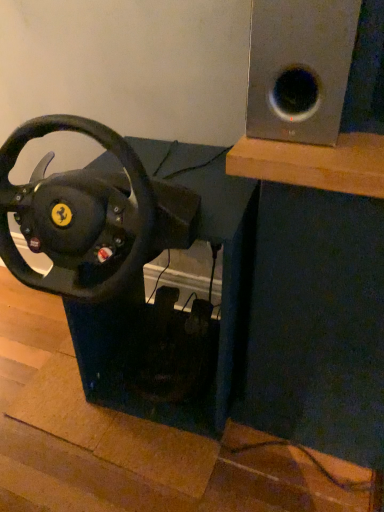
Describe the element at coordinates (299, 68) in the screenshot. The height and width of the screenshot is (512, 384). I see `silver metallic speaker at upper right` at that location.

Where is `silver metallic speaker at upper right`? The width and height of the screenshot is (384, 512). silver metallic speaker at upper right is located at coordinates pos(299,68).

Locate an element on the screen. This screenshot has height=512, width=384. silver metallic speaker at upper right is located at coordinates 299,68.